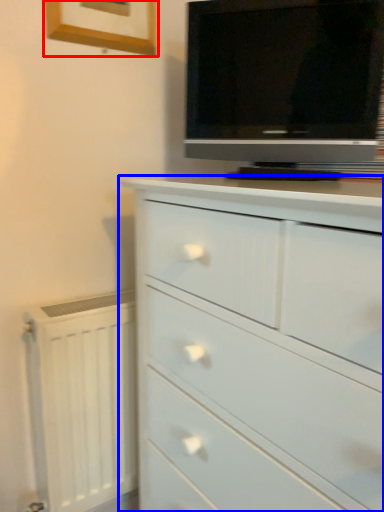
Question: Which of the following is the closest to the observer, picture frame (highlighted by a red box) or chest of drawers (highlighted by a blue box)?

Choices:
 (A) picture frame
 (B) chest of drawers

Answer: (B)